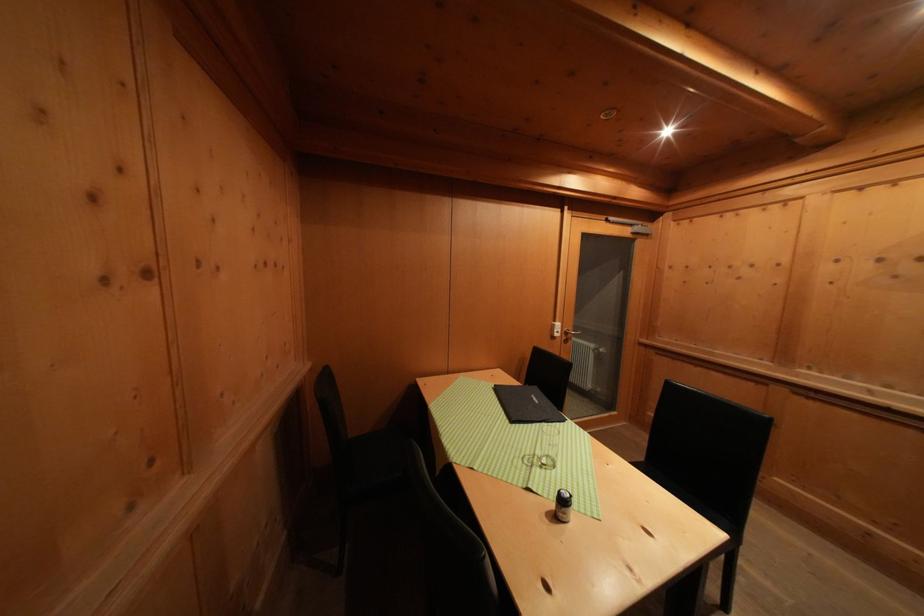
I want to click on white light switch, so click(554, 329).